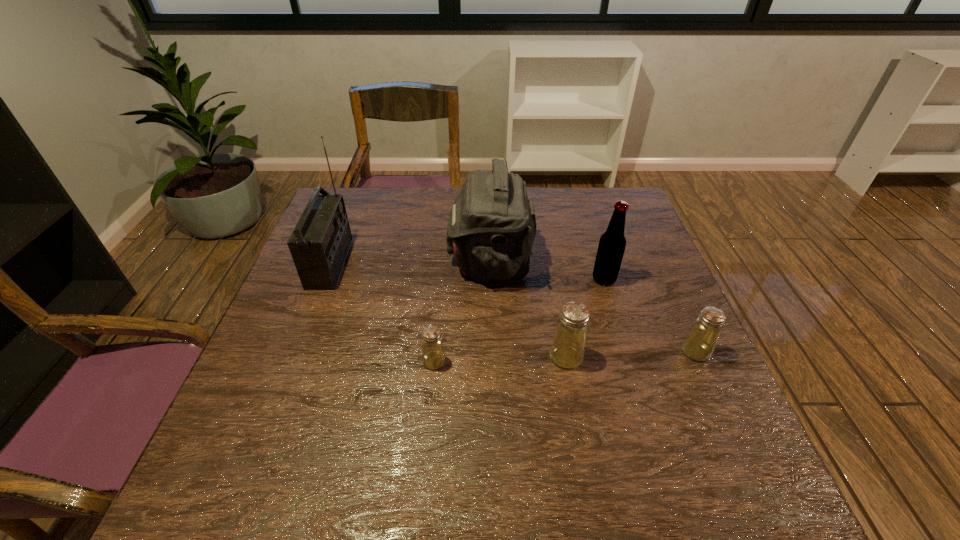
Find the location of a particular element. Image resolution: width=960 pixels, height=540 pixels. vacant region located 0.070m on the front of the leftmost saltshaker is located at coordinates (431, 400).

You are a GUI agent. You are given a task and a screenshot of the screen. Output one action in this format:
    pyautogui.click(x=<x>, y=<y>)
    Task: Click on the free space located on the back of the fourth tallest object
    This screenshot has width=960, height=540.
    Given the screenshot: What is the action you would take?
    pyautogui.click(x=548, y=256)

You are a GUI agent. You are given a task and a screenshot of the screen. Output one action in this format:
    pyautogui.click(x=<x>, y=<y>)
    Task: Click on the vacant region located 0.400m on the back of the rightmost object
    
    Given the screenshot: What is the action you would take?
    pyautogui.click(x=642, y=235)

This screenshot has height=540, width=960. I want to click on free location located on the open flap of the shoulder bag, so click(x=368, y=261).

Identify the location of vacant region located on the open flap of the shoulder bag. (426, 261).

At what (x,y) coordinates should I click in order to perform the action: click on free space located on the open flap of the shoulder bag. Please return your answer as a coordinate pair (x, y). Looking at the image, I should click on (349, 261).

This screenshot has width=960, height=540. Identify the location of vacant position located on the front panel of the leftmost object. (474, 263).

Where is `free location located on the front of the fifth object from left to right`? The width and height of the screenshot is (960, 540). free location located on the front of the fifth object from left to right is located at coordinates (617, 322).

Find the location of a particular element. object that is positioned at the left edge is located at coordinates (319, 244).

I want to click on saltshaker located at the right edge, so click(x=699, y=344).